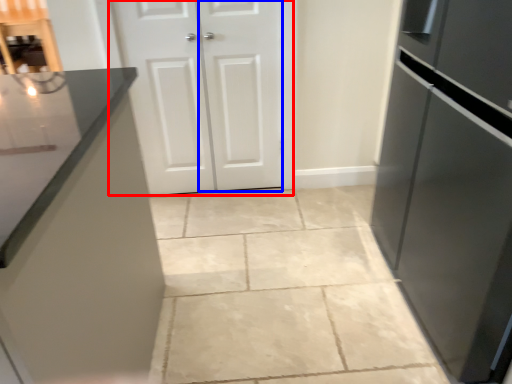
Question: Which of the following is the farthest to the observer, door (highlighted by a red box) or door (highlighted by a blue box)?

Choices:
 (A) door
 (B) door

Answer: (B)